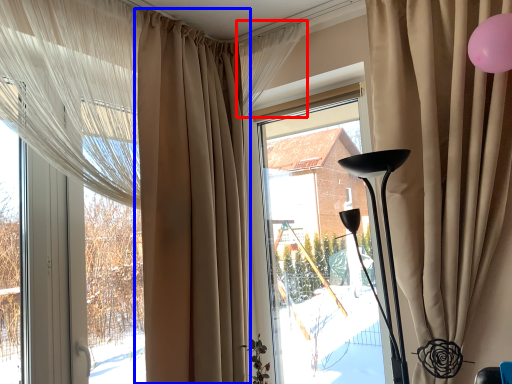
Question: Which point is closer to the camera, curtain (highlighted by a red box) or curtain (highlighted by a blue box)?

Choices:
 (A) curtain
 (B) curtain

Answer: (B)